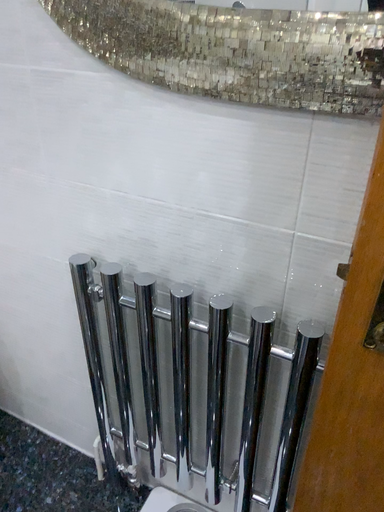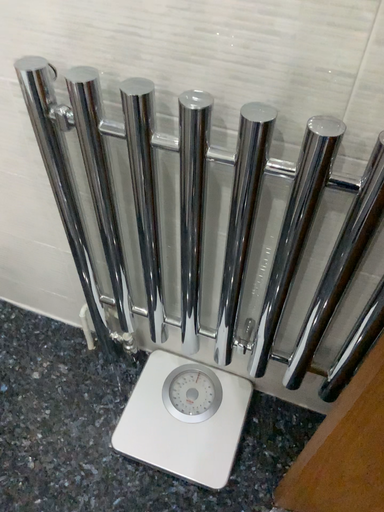
Question: How did the camera likely rotate when shooting the video?

Choices:
 (A) rotated upward
 (B) rotated downward

Answer: (B)